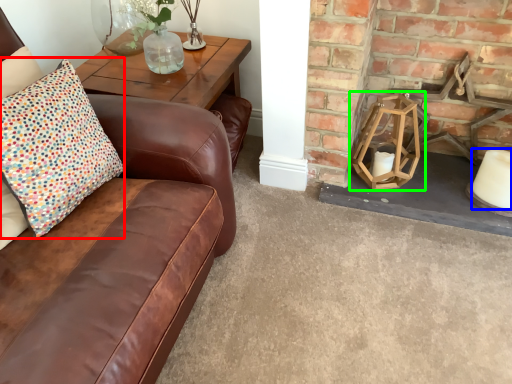
Question: Which object is the farthest from pillow (highlighted by a red box)? Choose among these: candle (highlighted by a blue box) or candle holder (highlighted by a green box).

Choices:
 (A) candle
 (B) candle holder

Answer: (A)